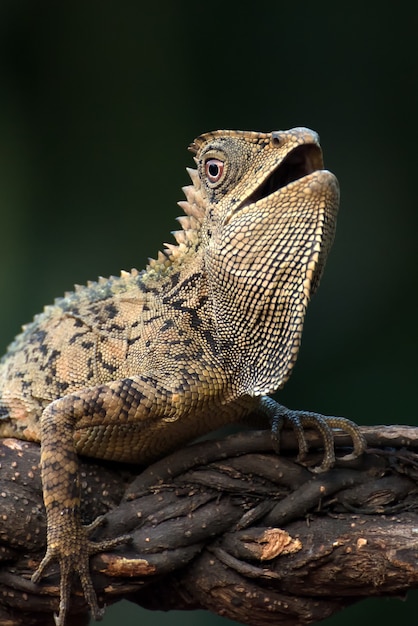
Where is `scales`? The height and width of the screenshot is (626, 418). scales is located at coordinates pyautogui.click(x=145, y=354).